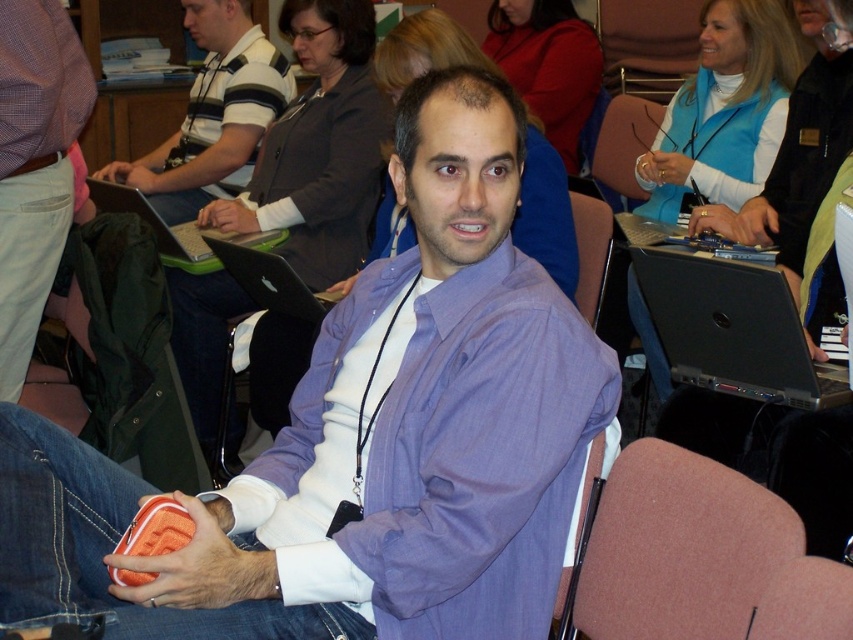
You are sitting in a conference room and need to find the striped cotton shirt at center. Which direction should you look relative to the brown fabric chair at center?

The brown fabric chair at center is to the right of striped cotton shirt at center, so you should look to the left of the brown fabric chair at center to find the striped cotton shirt at center.

You are standing at the center of the conference room and see two points marked in the image. The first point is at coordinate point(x=482, y=605) and the second point is at coordinate point(x=613, y=156). Which point is closer to you?

Point(x=482, y=605) is in front of point(x=613, y=156), so it is closer to you.